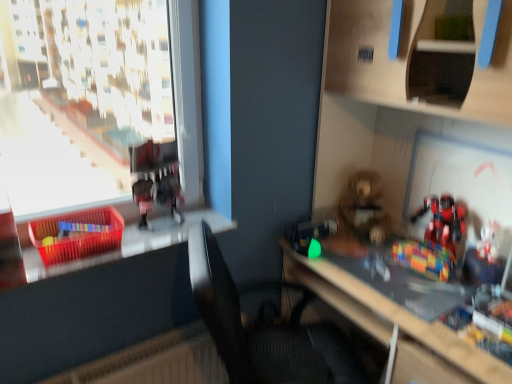
Locate an element on the screen. free space between metallic red robot at upper left, placed as the 1th toy when sorted from left to right, and translucent plastic crate at left is located at coordinates (142, 241).